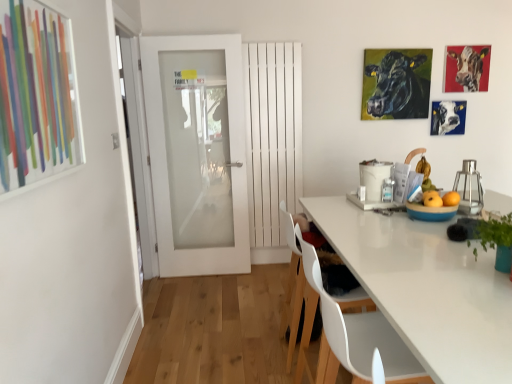
At what (x,y) coordinates should I click in order to perform the action: click on blank area beneath yellow matte apple at right (from a real-world perspective). Please return your answer as a coordinate pair (x, y). Looking at the image, I should click on click(x=429, y=201).